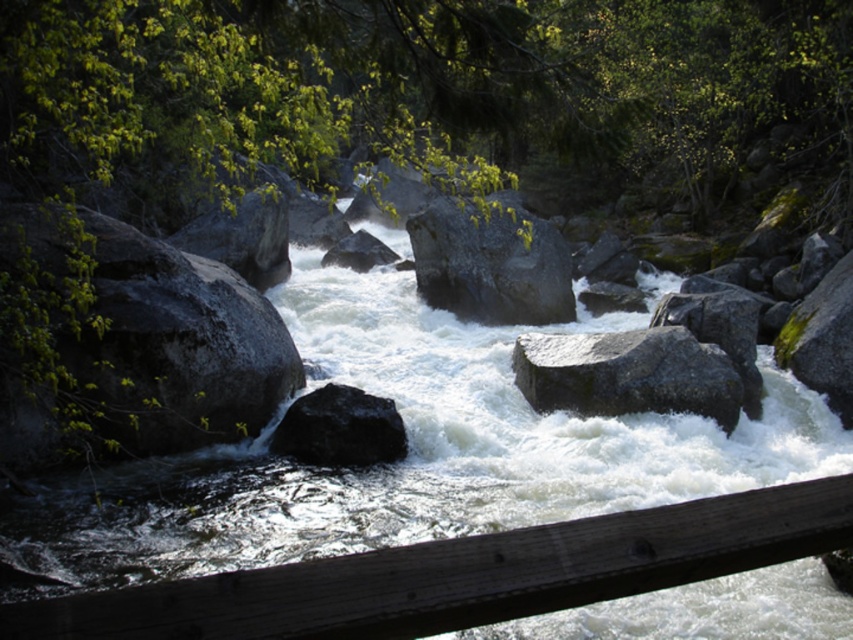
Question: Can you confirm if white frothy water at center is positioned to the left of black smooth rock at center?

Choices:
 (A) no
 (B) yes

Answer: (A)

Question: Which point is closer to the camera?

Choices:
 (A) black smooth rock at center
 (B) green mossy rock at right
 (C) smooth gray rock at center

Answer: (A)

Question: Is gray smooth rock at center behind green mossy rock at right?

Choices:
 (A) no
 (B) yes

Answer: (A)

Question: Among these objects, which one is farthest from the camera?

Choices:
 (A) gray smooth rock at center
 (B) black smooth rock at center

Answer: (A)

Question: Which point is farther to the camera?

Choices:
 (A) dark gray rock at left
 (B) green mossy rock at right

Answer: (B)

Question: In this image, where is white frothy water at center located relative to dark gray rock at left?

Choices:
 (A) above
 (B) below

Answer: (A)